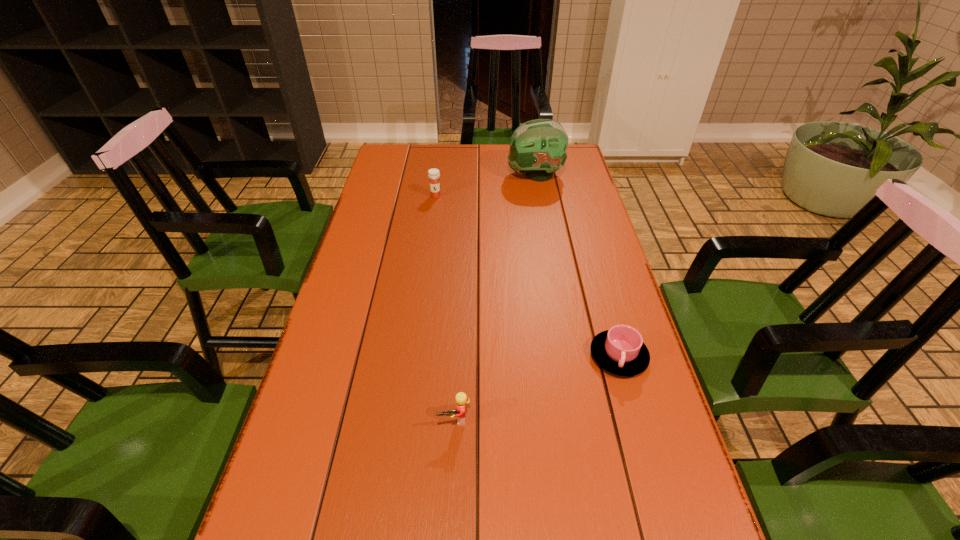
In the image, there is a desktop. Where is `vacant space at the right edge`? The height and width of the screenshot is (540, 960). vacant space at the right edge is located at coordinates (632, 509).

Find the location of `blank area at the far left corner`. blank area at the far left corner is located at coordinates (414, 156).

The image size is (960, 540). In order to click on free space between the tallest object and the medicine in this screenshot , I will do `click(486, 185)`.

Image resolution: width=960 pixels, height=540 pixels. In order to click on vacant space in between the second nearest object and the tallest object in this screenshot , I will do `click(577, 266)`.

Image resolution: width=960 pixels, height=540 pixels. I want to click on vacant area that lies between the cup and the medicine, so click(527, 276).

The width and height of the screenshot is (960, 540). Find the location of `vacant area between the third nearest object and the tallest object`. vacant area between the third nearest object and the tallest object is located at coordinates (486, 185).

Image resolution: width=960 pixels, height=540 pixels. Find the location of `vacant space that's between the second object from left to right and the tallest object`. vacant space that's between the second object from left to right and the tallest object is located at coordinates (494, 297).

Identify the location of free space between the second object from left to right and the tallest object. (494, 297).

You are a GUI agent. You are given a task and a screenshot of the screen. Output one action in this format:
    pyautogui.click(x=<x>, y=<y>)
    Task: Click on the free area in between the football helmet and the Lego
    
    Given the screenshot: What is the action you would take?
    coord(494,297)

The image size is (960, 540). What are the coordinates of `free space that is in between the tallest object and the shortest object` in the screenshot? It's located at (577, 266).